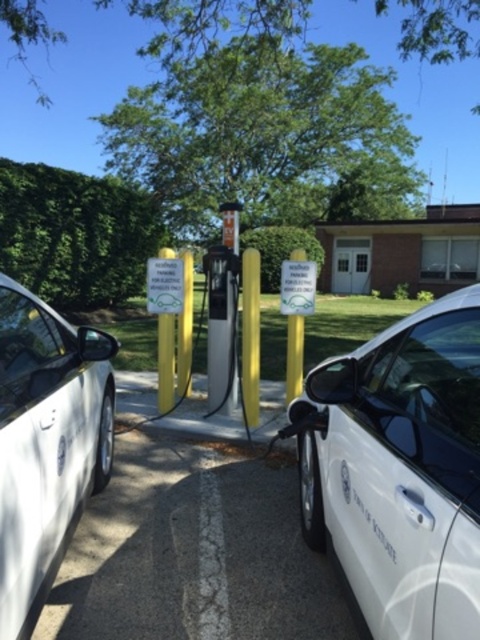
Can you confirm if white glossy car at center is shorter than white matte car at left?

Yes, white glossy car at center is shorter than white matte car at left.

Between white glossy car at center and white matte car at left, which one is positioned lower?

white matte car at left is lower down.

Between point (472, 340) and point (12, 600), which one is positioned behind?

The point (12, 600) is behind.

Locate an element on the screen. white glossy car at center is located at coordinates (399, 470).